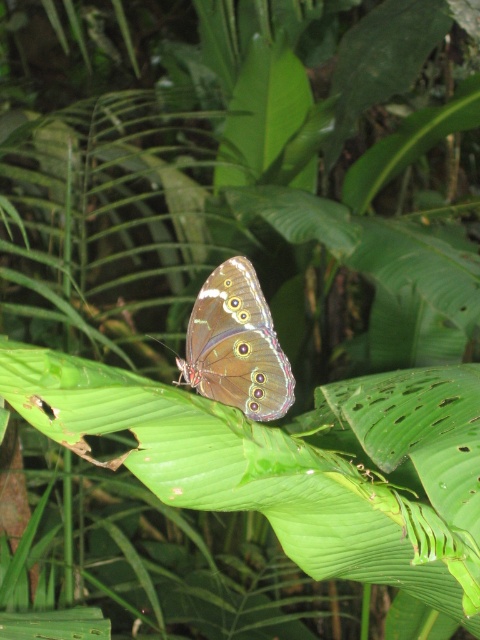
You are a botanist studying the tropical ecosystem. You notice a point marked at coordinates [282,468] on the image. According to the scene description, which object is this point located on?

The point is located on the green matte leaf at center.

You are a photographer trying to capture the brown iridescent butterfly at center. You notice the green matte leaf at center is blocking your view. Can you move the leaf to get a clear shot of the butterfly?

The green matte leaf at center is closer to the viewer than the brown iridescent butterfly at center, so moving the leaf would allow you to see the butterfly clearly.